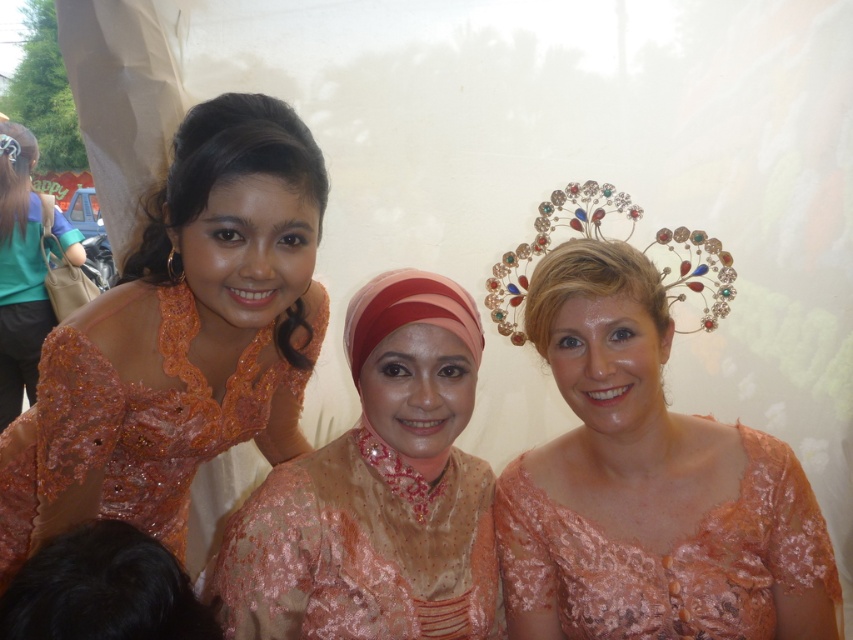
Question: Considering the real-world distances, which object is closest to the lace dress at center?

Choices:
 (A) pale pink satin hijab at center
 (B) matte peach lace dress at center
 (C) matte orange dress at left
 (D) lace dress at upper left

Answer: (B)

Question: Which of the following is the closest to the observer?

Choices:
 (A) lace dress at center
 (B) lace dress at upper left

Answer: (B)

Question: Is matte peach lace dress at center positioned at the back of matte orange dress at left?

Choices:
 (A) yes
 (B) no

Answer: (B)

Question: Does lace dress at upper left have a smaller size compared to pale pink satin hijab at center?

Choices:
 (A) yes
 (B) no

Answer: (B)

Question: Does matte peach lace dress at center appear under matte orange dress at left?

Choices:
 (A) yes
 (B) no

Answer: (A)

Question: Which point is closer to the camera?

Choices:
 (A) (526, 564)
 (B) (61, 456)
 (C) (403, 280)
 (D) (521, 476)

Answer: (B)